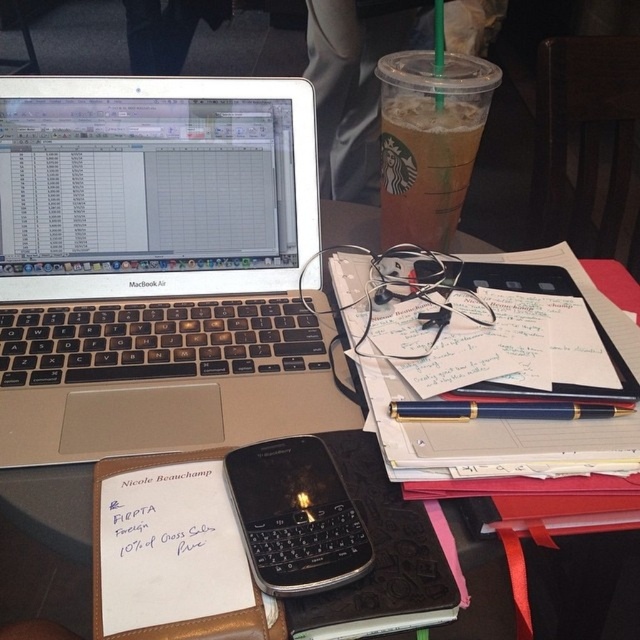
You are organizing the items on the desk and need to place a new folder between the silver metallic laptop at upper left and the white paper at center. Based on their positions, where should you place the folder?

The silver metallic laptop at upper left is located above the white paper at center, so you should place the folder between them in the space below the laptop and above the white paper at center.

Looking at this image, you are a barista at the Starbucks in the image. You need to place a new cup of coffee on the workspace so it doesn not spill. The cup must be placed at least 10 centimeters away from the black plastic phone at center. Can you place the new cup in the location currently occupied by the translucent plastic cup at upper center?

The translucent plastic cup at upper center is 35.76 centimeters from the black plastic phone at center, which is more than the required 10 centimeters. Therefore, placing the new cup there would be safe and meet the requirement.

You have a rectangular box that is 12 inches wide. You need to place it on the workspace shown in the image. Based on the silver metallic laptop at upper left and the white paper at center, which object can the box fit under in terms of width?

The silver metallic laptop at upper left is wider than the white paper at center. Since the box is 12 inches wide, it can fit under the silver metallic laptop at upper left if its width is less than 12 inches. However, without knowing the exact width of the laptop, we cannot definitively say. Alternatively, the white paper at center, being narrower, might also accommodate the box if its width is within 12 inches. The answer depends on the actual dimensions, but according to the description, the laptop is W.